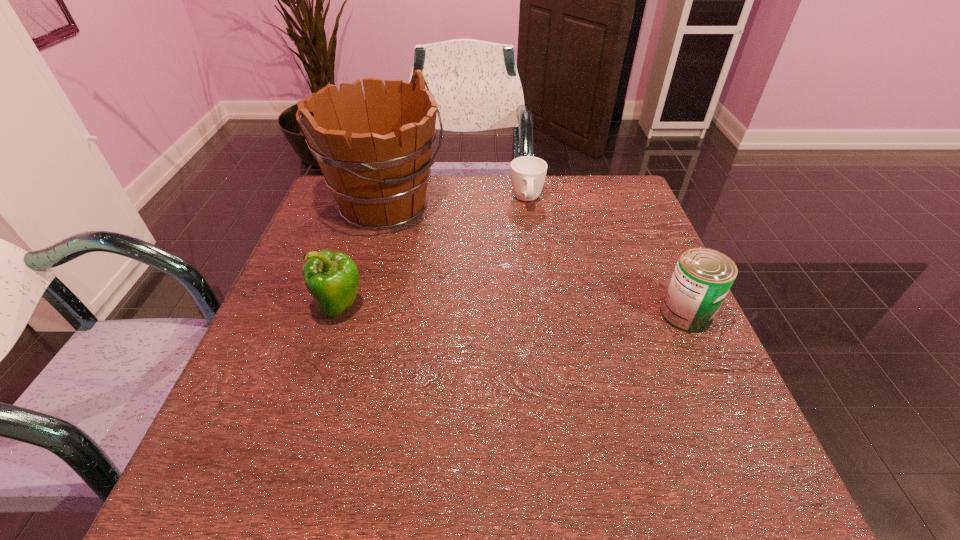
Where is `the second tallest object`? the second tallest object is located at coordinates (332, 279).

Identify the location of the rightmost object. (702, 278).

Where is `can`? The width and height of the screenshot is (960, 540). can is located at coordinates (702, 278).

This screenshot has height=540, width=960. What are the coordinates of `the third object from left to right` in the screenshot? It's located at (528, 173).

Locate an element on the screen. the shortest object is located at coordinates (528, 173).

Where is `the tallest object`? The height and width of the screenshot is (540, 960). the tallest object is located at coordinates (379, 180).

Locate an element on the screen. This screenshot has height=540, width=960. vacant area situated on the back of the bell pepper is located at coordinates (371, 210).

You are a GUI agent. You are given a task and a screenshot of the screen. Output one action in this format:
    pyautogui.click(x=<x>, y=<y>)
    Task: Click on the free space located on the front of the rightmost object
    The height and width of the screenshot is (540, 960).
    Given the screenshot: What is the action you would take?
    pyautogui.click(x=711, y=369)

At what (x,y) coordinates should I click in order to perform the action: click on vacant space situated with the handle on the side of the cup. Please return your answer as a coordinate pair (x, y). Image resolution: width=960 pixels, height=540 pixels. Looking at the image, I should click on (543, 326).

Locate an element on the screen. vacant area located 0.100m with the handle on the side of the cup is located at coordinates (532, 237).